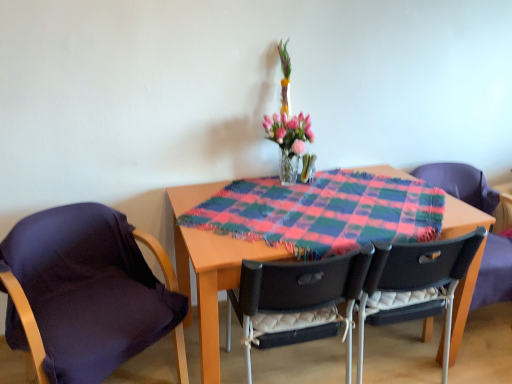
Locate an element on the screen. This screenshot has width=512, height=384. plaid fabric at center is located at coordinates (323, 212).

The height and width of the screenshot is (384, 512). I want to click on translucent glass vase at center, so click(290, 130).

Find the location of a particular element. This screenshot has width=512, height=384. plaid fabric at center is located at coordinates coord(323,212).

Considering the relative sizes of dark purple fabric at left, acting as the 1th chair starting from the left, and black plastic chair at center, which appears as the second chair when viewed from the left, in the image provided, is dark purple fabric at left, acting as the 1th chair starting from the left, bigger than black plastic chair at center, which appears as the second chair when viewed from the left,?

Yes.

From the image's perspective, which one is positioned lower, dark purple fabric at left, acting as the 1th chair starting from the left, or black plastic chair at center, which appears as the second chair when viewed from the left?

black plastic chair at center, which appears as the second chair when viewed from the left, is shown below in the image.

What's the angular difference between dark purple fabric at left, the 4th chair positioned from the right, and black plastic chair at center, which appears as the second chair when viewed from the left,'s facing directions?

There is a 152-degree angle between the facing directions of dark purple fabric at left, the 4th chair positioned from the right, and black plastic chair at center, which appears as the second chair when viewed from the left.

This screenshot has height=384, width=512. What are the coordinates of `chair below the dark purple fabric at left, the 4th chair positioned from the right (from the image's perspective)` in the screenshot? It's located at (300, 290).

How different are the orientations of black plastic chair at center, the 3th chair when ordered from left to right, and matte black chair at right, the fourth chair from the left, in degrees?

black plastic chair at center, the 3th chair when ordered from left to right, and matte black chair at right, the fourth chair from the left, are facing 173 degrees away from each other.

Would you say black plastic chair at center, marked as the 2th chair in a right-to-left arrangement, contains matte black chair at right, which appears as the 1th chair when viewed from the right?

No, matte black chair at right, which appears as the 1th chair when viewed from the right, is not surrounded by black plastic chair at center, marked as the 2th chair in a right-to-left arrangement.

Which of these two, black plastic chair at center, the 3th chair when ordered from left to right, or matte black chair at right, the fourth chair from the left, is thinner?

black plastic chair at center, the 3th chair when ordered from left to right.

Which is behind, point (450, 245) or point (500, 282)?

Point (500, 282)

Which object is thinner, translucent glass vase at center or matte black chair at right, which appears as the 1th chair when viewed from the right?

With smaller width is translucent glass vase at center.

Is translucent glass vase at center positioned with its back to matte black chair at right, which appears as the 1th chair when viewed from the right?

That's not correct — translucent glass vase at center is not looking away from matte black chair at right, which appears as the 1th chair when viewed from the right.

Considering the sizes of objects black plastic chair at center, marked as the 2th chair in a right-to-left arrangement, and dark purple fabric at left, the 4th chair positioned from the right, in the image provided, who is smaller, black plastic chair at center, marked as the 2th chair in a right-to-left arrangement, or dark purple fabric at left, the 4th chair positioned from the right,?

black plastic chair at center, marked as the 2th chair in a right-to-left arrangement, is smaller.

Can you tell me how much black plastic chair at center, the 3th chair when ordered from left to right, and dark purple fabric at left, acting as the 1th chair starting from the left, differ in facing direction?

The facing directions of black plastic chair at center, the 3th chair when ordered from left to right, and dark purple fabric at left, acting as the 1th chair starting from the left, are 152 degrees apart.

Are black plastic chair at center, the 3th chair when ordered from left to right, and dark purple fabric at left, acting as the 1th chair starting from the left, located far from each other?

Yes, black plastic chair at center, the 3th chair when ordered from left to right, and dark purple fabric at left, acting as the 1th chair starting from the left, are located far from each other.

From a real-world perspective, which object rests below the other?

dark purple fabric at left, the 4th chair positioned from the right.

Which point is more forward, [453,326] or [36,342]?

Positioned in front is point [36,342].

Is matte black chair at right, which appears as the 1th chair when viewed from the right, positioned with its back to dark purple fabric at left, acting as the 1th chair starting from the left?

matte black chair at right, which appears as the 1th chair when viewed from the right, is not turned away from dark purple fabric at left, acting as the 1th chair starting from the left.

Between matte black chair at right, which appears as the 1th chair when viewed from the right, and dark purple fabric at left, acting as the 1th chair starting from the left, which one has smaller width?

→ matte black chair at right, which appears as the 1th chair when viewed from the right, is thinner.

Who is taller, matte black chair at right, which appears as the 1th chair when viewed from the right, or dark purple fabric at left, the 4th chair positioned from the right?

With more height is matte black chair at right, which appears as the 1th chair when viewed from the right.

Is black plastic chair at center, which is the third chair in right-to-left order, facing towards black plastic chair at center, the 3th chair when ordered from left to right?

No, black plastic chair at center, which is the third chair in right-to-left order, is not turned towards black plastic chair at center, the 3th chair when ordered from left to right.

Considering the relative positions of black plastic chair at center, which is the third chair in right-to-left order, and black plastic chair at center, marked as the 2th chair in a right-to-left arrangement, in the image provided, is black plastic chair at center, which is the third chair in right-to-left order, to the right of black plastic chair at center, marked as the 2th chair in a right-to-left arrangement, from the viewer's perspective?

In fact, black plastic chair at center, which is the third chair in right-to-left order, is to the left of black plastic chair at center, marked as the 2th chair in a right-to-left arrangement.

Considering the positions of point (334, 291) and point (435, 287), is point (334, 291) closer or farther from the camera than point (435, 287)?

Point (334, 291) is positioned closer to the camera compared to point (435, 287).

Which object is positioned more to the left, matte black chair at right, which appears as the 1th chair when viewed from the right, or plaid fabric at center?

plaid fabric at center is more to the left.

From a real-world perspective, is matte black chair at right, the fourth chair from the left, located higher than plaid fabric at center?

No.

Which is closer to the camera, (477, 301) or (285, 216)?

Point (477, 301) is positioned farther from the camera compared to point (285, 216).

Is matte black chair at right, the fourth chair from the left, shorter than plaid fabric at center?

No.

You are a GUI agent. You are given a task and a screenshot of the screen. Output one action in this format:
    pyautogui.click(x=<x>, y=<y>)
    Task: Click on the chair in front of the black plastic chair at center, which is the third chair in right-to-left order
    
    Given the screenshot: What is the action you would take?
    pyautogui.click(x=86, y=293)

I want to click on the 1st chair counting from the left of the matte black chair at right, the fourth chair from the left, so click(x=417, y=283).

When comparing their distances from translucent glass vase at center, does black plastic chair at center, the 3th chair when ordered from left to right, or black plastic chair at center, which is the third chair in right-to-left order, seem closer?

black plastic chair at center, which is the third chair in right-to-left order, is positioned closer to the anchor translucent glass vase at center.

Estimate the real-world distances between objects in this image. Which object is further from plaid fabric at center, dark purple fabric at left, the 4th chair positioned from the right, or black plastic chair at center, which appears as the second chair when viewed from the left?

Among the two, dark purple fabric at left, the 4th chair positioned from the right, is located further to plaid fabric at center.

Which object lies nearer to the anchor point dark purple fabric at left, acting as the 1th chair starting from the left, matte black chair at right, the fourth chair from the left, or black plastic chair at center, which appears as the second chair when viewed from the left?

black plastic chair at center, which appears as the second chair when viewed from the left.

Estimate the real-world distances between objects in this image. Which object is closer to black plastic chair at center, marked as the 2th chair in a right-to-left arrangement, matte black chair at right, which appears as the 1th chair when viewed from the right, or plaid fabric at center?

plaid fabric at center is closer to black plastic chair at center, marked as the 2th chair in a right-to-left arrangement.

When comparing their distances from dark purple fabric at left, acting as the 1th chair starting from the left, does plaid fabric at center or black plastic chair at center, which is the third chair in right-to-left order, seem further?

The object further to dark purple fabric at left, acting as the 1th chair starting from the left, is plaid fabric at center.

Estimate the real-world distances between objects in this image. Which object is closer to black plastic chair at center, marked as the 2th chair in a right-to-left arrangement, translucent glass vase at center or dark purple fabric at left, acting as the 1th chair starting from the left?

translucent glass vase at center is positioned closer to the anchor black plastic chair at center, marked as the 2th chair in a right-to-left arrangement.

Estimate the real-world distances between objects in this image. Which object is closer to translucent glass vase at center, black plastic chair at center, which is the third chair in right-to-left order, or matte black chair at right, the fourth chair from the left?

Among the two, black plastic chair at center, which is the third chair in right-to-left order, is located nearer to translucent glass vase at center.

Looking at the image, which one is located further to black plastic chair at center, marked as the 2th chair in a right-to-left arrangement, plaid fabric at center or translucent glass vase at center?

Based on the image, translucent glass vase at center appears to be further to black plastic chair at center, marked as the 2th chair in a right-to-left arrangement.

Locate an element on the screen. The height and width of the screenshot is (384, 512). blanket between dark purple fabric at left, the 4th chair positioned from the right, and black plastic chair at center, the 3th chair when ordered from left to right, in the horizontal direction is located at coordinates (323, 212).

Find the location of a particular element. The width and height of the screenshot is (512, 384). floral arrangement between black plastic chair at center, which appears as the second chair when viewed from the left, and matte black chair at right, the fourth chair from the left, in the horizontal direction is located at coordinates (290, 130).

Image resolution: width=512 pixels, height=384 pixels. Find the location of `blanket that lies between translucent glass vase at center and black plastic chair at center, marked as the 2th chair in a right-to-left arrangement, from top to bottom`. blanket that lies between translucent glass vase at center and black plastic chair at center, marked as the 2th chair in a right-to-left arrangement, from top to bottom is located at coordinates (323, 212).

This screenshot has width=512, height=384. I want to click on chair situated between dark purple fabric at left, acting as the 1th chair starting from the left, and plaid fabric at center from left to right, so click(300, 290).